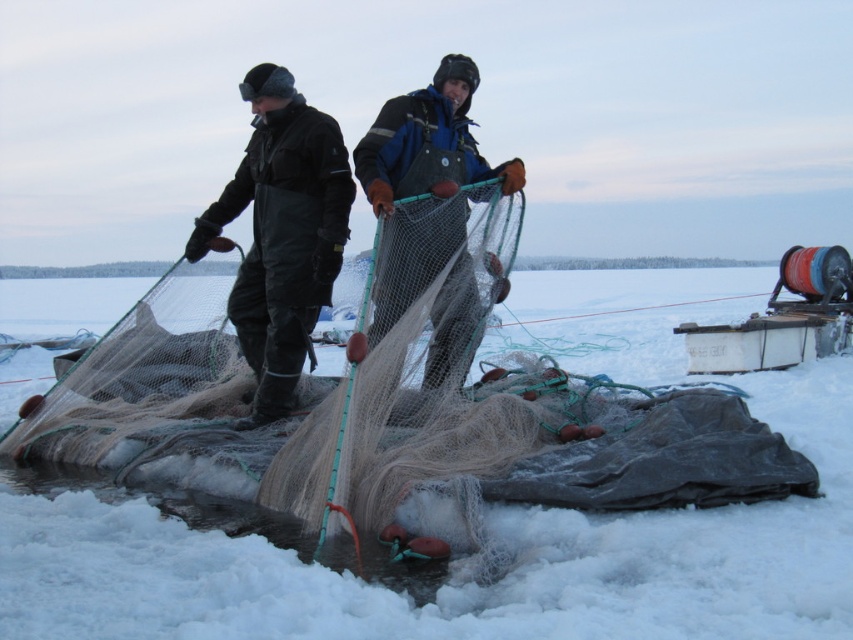
Between point (840, 522) and point (306, 243), which one is positioned in front?

Positioned in front is point (840, 522).

Is white fluffy snow at center wider than dark green waterproof overalls at center?

Correct, the width of white fluffy snow at center exceeds that of dark green waterproof overalls at center.

Does point (627, 532) come in front of point (236, 317)?

Yes, it is in front of point (236, 317).

I want to click on white fluffy snow at center, so click(x=469, y=564).

How much distance is there between white fluffy snow at center and blue fabric net at center?

A distance of 3.08 meters exists between white fluffy snow at center and blue fabric net at center.

Is white fluffy snow at center wider than blue fabric net at center?

Indeed, white fluffy snow at center has a greater width compared to blue fabric net at center.

What do you see at coordinates (469, 564) in the screenshot? Image resolution: width=853 pixels, height=640 pixels. I see `white fluffy snow at center` at bounding box center [469, 564].

Where is `white fluffy snow at center`? The height and width of the screenshot is (640, 853). white fluffy snow at center is located at coordinates (469, 564).

Is dark green waterproof overalls at center closer to camera compared to blue fabric net at center?

No, it is not.

Who is positioned more to the right, dark green waterproof overalls at center or blue fabric net at center?

blue fabric net at center is more to the right.

I want to click on dark green waterproof overalls at center, so click(281, 232).

The image size is (853, 640). I want to click on dark green waterproof overalls at center, so click(x=281, y=232).